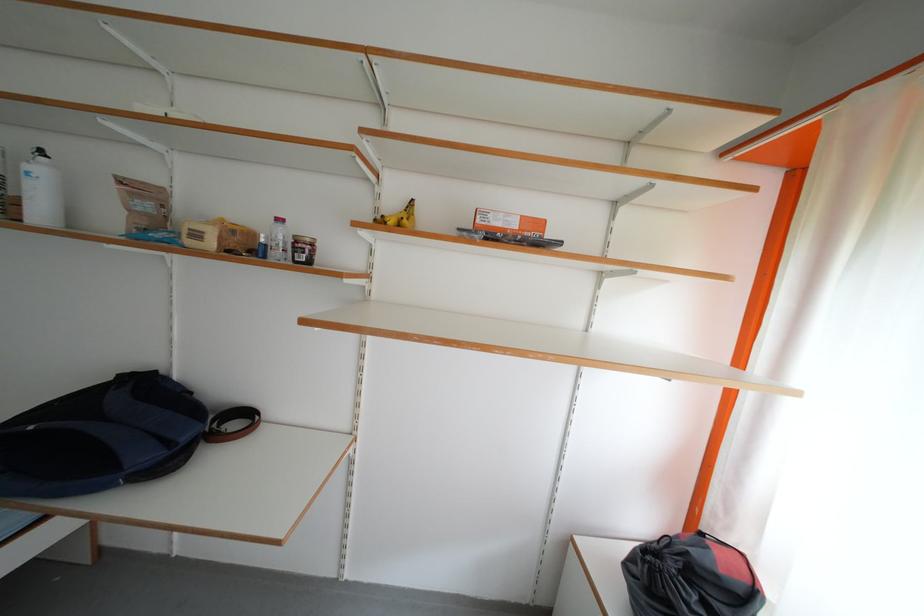
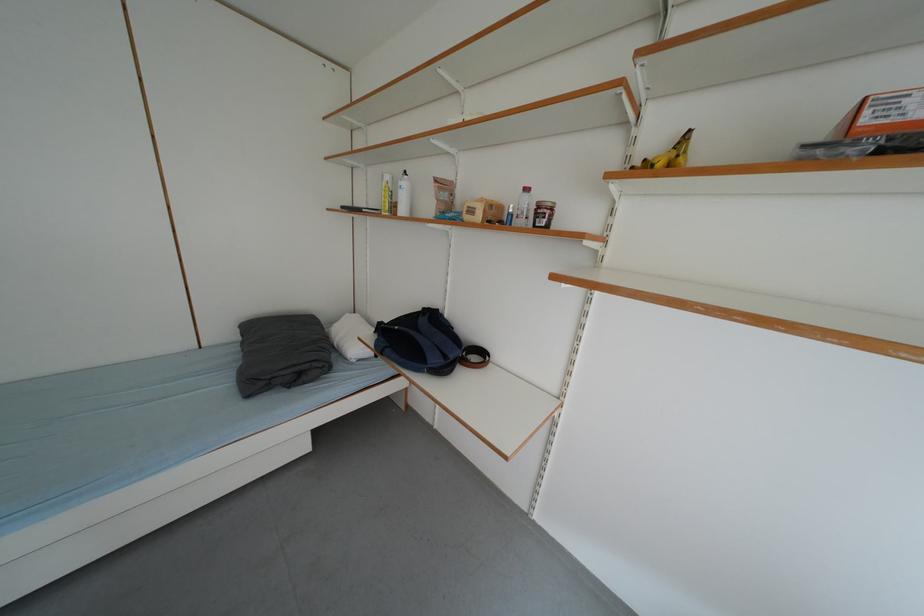
In the second image, find the point that corresponds to point (220, 248) in the first image.

(487, 220)